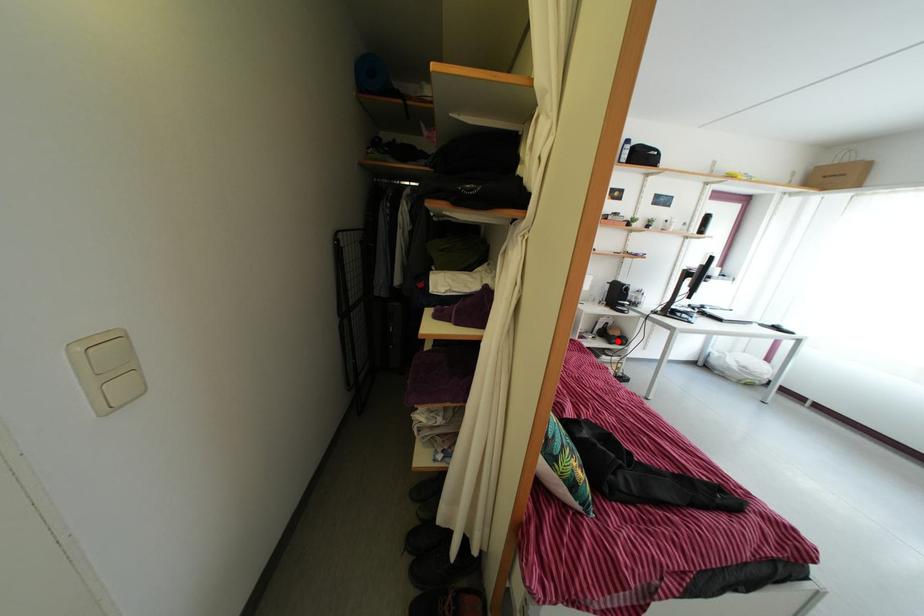
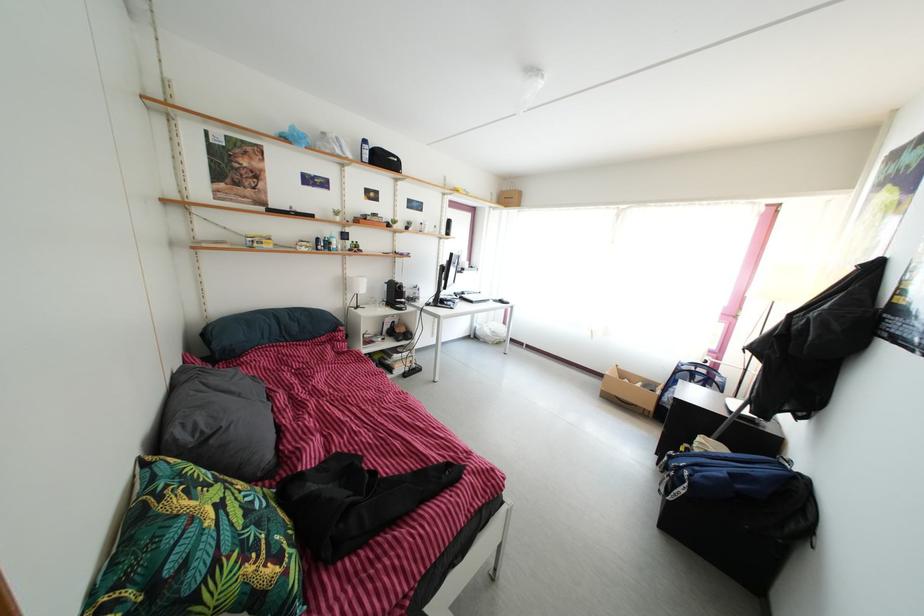
Question: I am providing you with two images of the same scene from different viewpoints. A red point is shown in image1. For the corresponding object point in image2, is it positioned nearer or farther from the camera?

Choices:
 (A) Nearer
 (B) Farther

Answer: (A)